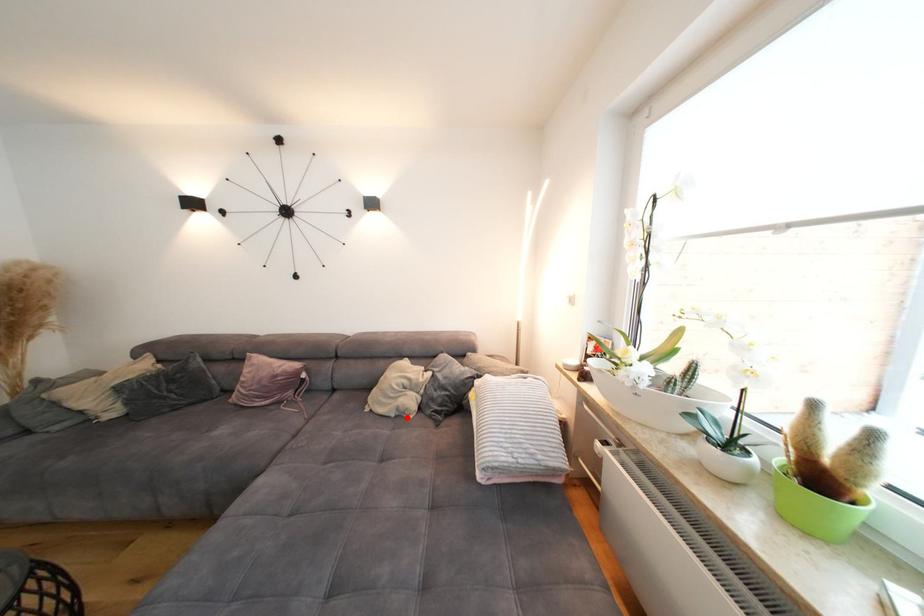
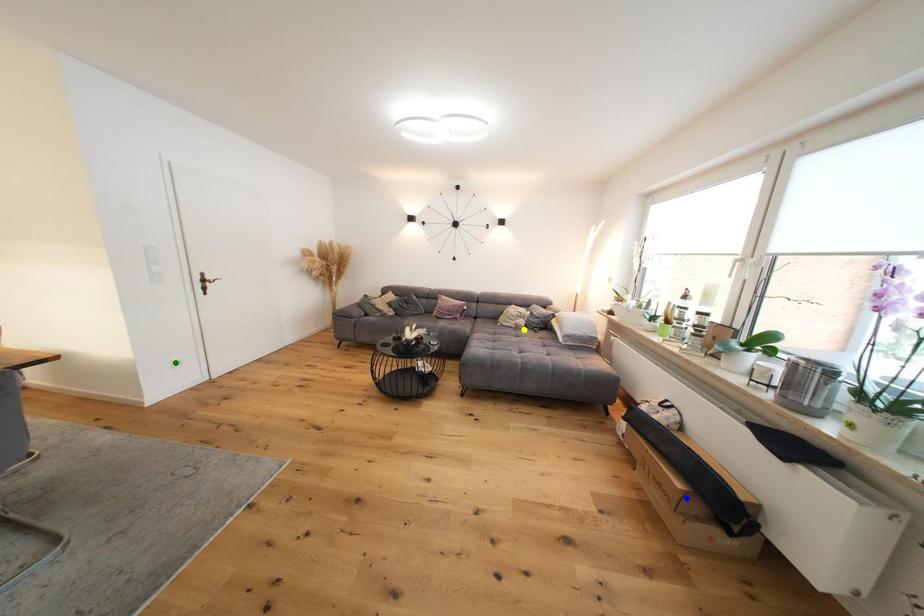
Question: I am providing you with two images of the same scene from different viewpoints. A red point is marked on the first image. You are given multiple points on the second image. Which point in image 2 is actually the same real-world point as the red point in image 1?

Choices:
 (A) green point
 (B) yellow point
 (C) blue point

Answer: (B)